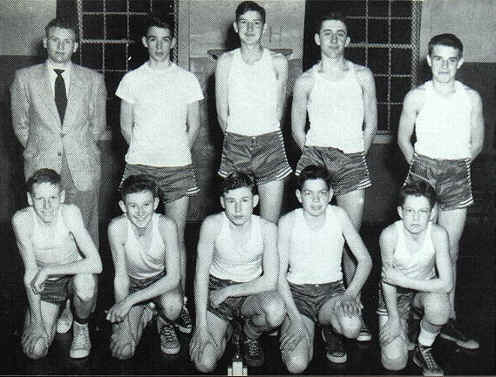
Find the location of a particular element. This screenshot has width=496, height=377. window is located at coordinates (406, 58).